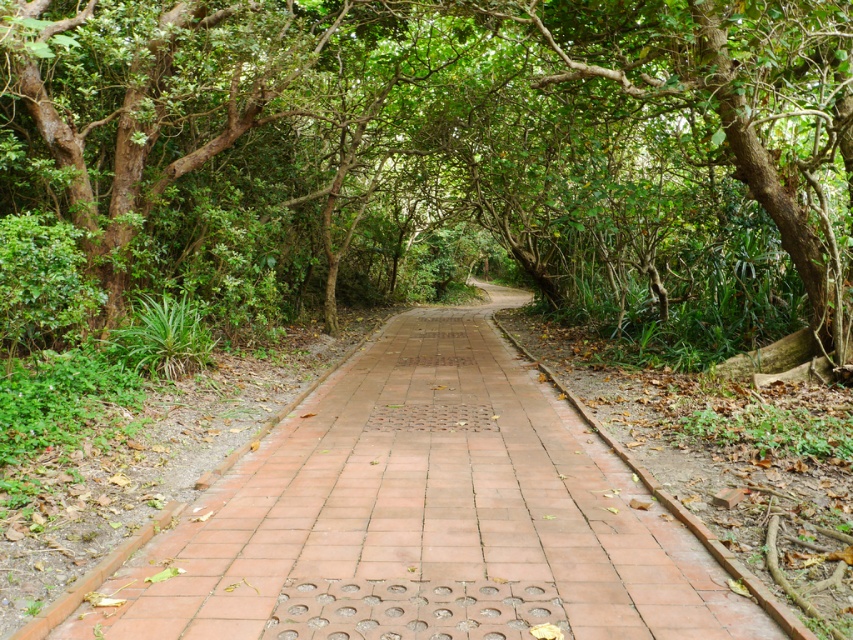
Does green leafy tree at center have a larger size compared to terracotta brick pavement at center?

Yes, green leafy tree at center is bigger than terracotta brick pavement at center.

Is green leafy tree at center above terracotta brick pavement at center?

Indeed, green leafy tree at center is positioned over terracotta brick pavement at center.

Who is more forward, (410, 13) or (109, 636)?

Point (109, 636) is more forward.

Find the location of a particular element. The image size is (853, 640). green leafy tree at center is located at coordinates (447, 150).